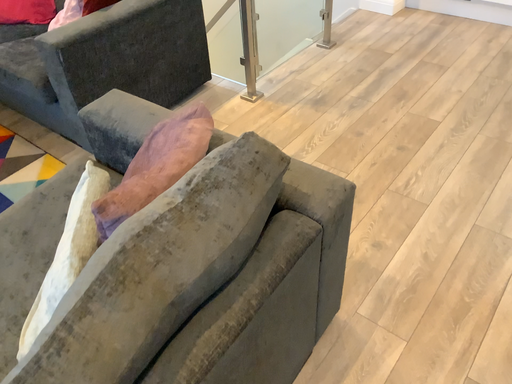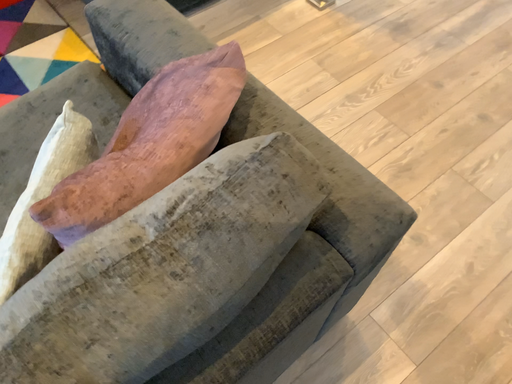
Question: How did the camera likely rotate when shooting the video?

Choices:
 (A) rotated right
 (B) rotated left

Answer: (B)